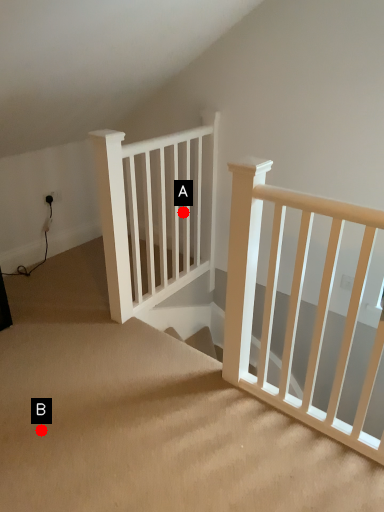
Question: Two points are circled on the image, labeled by A and B beside each circle. Which of the following is the farthest from the observer?

Choices:
 (A) A is further
 (B) B is further

Answer: (A)